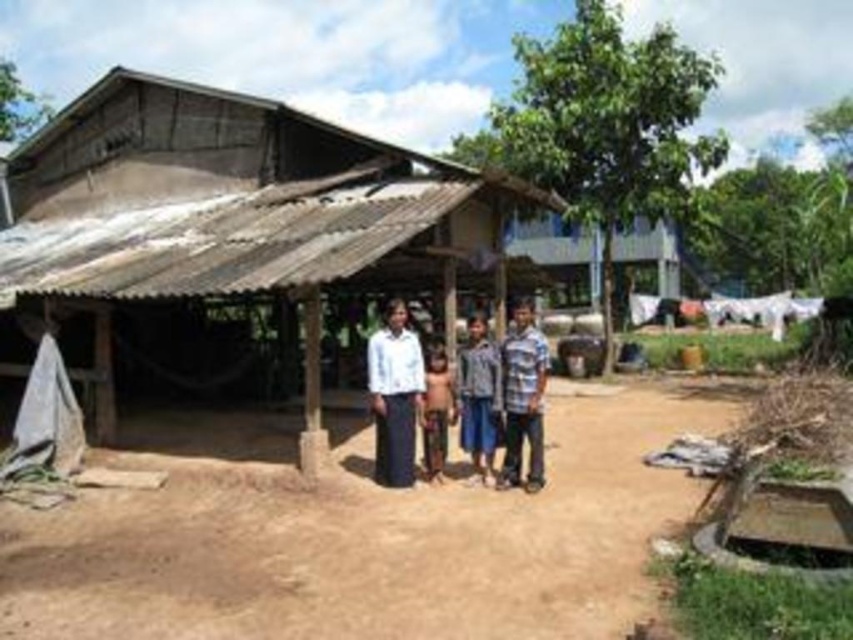
Question: Which of these objects is positioned closest to the brown fabric at center?

Choices:
 (A) blue denim shirt at center
 (B) weathered wood hut at center

Answer: (A)

Question: Is brown sandy dirt field at center further to camera compared to blue denim shirt at center?

Choices:
 (A) no
 (B) yes

Answer: (A)

Question: Among these points, which one is farthest from the camera?

Choices:
 (A) (x=181, y=209)
 (B) (x=370, y=392)
 (C) (x=515, y=481)
 (D) (x=120, y=493)

Answer: (A)

Question: Can you confirm if weathered wood hut at center is positioned above white cotton shirt at center?

Choices:
 (A) no
 (B) yes

Answer: (B)

Question: Which of the following is the farthest from the observer?

Choices:
 (A) weathered wood hut at center
 (B) white matte shirt at center
 (C) brown sandy dirt field at center
 (D) brown fabric at center

Answer: (D)

Question: Is weathered wood hut at center thinner than blue denim shirt at center?

Choices:
 (A) no
 (B) yes

Answer: (A)